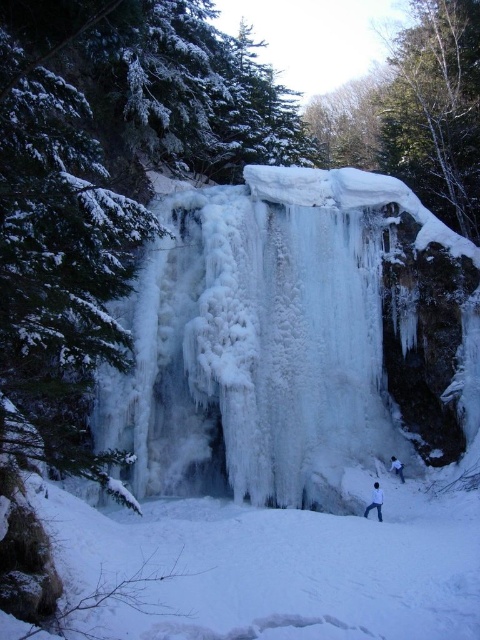
Question: Is white matte jacket at lower center to the right of gray fabric skier at lower right from the viewer's perspective?

Choices:
 (A) yes
 (B) no

Answer: (B)

Question: Is white matte jacket at lower center above gray fabric skier at lower right?

Choices:
 (A) no
 (B) yes

Answer: (A)

Question: Which point appears closest to the camera in this image?

Choices:
 (A) (396, 461)
 (B) (367, 515)

Answer: (B)

Question: From the image, what is the correct spatial relationship of white matte jacket at lower center in relation to gray fabric skier at lower right?

Choices:
 (A) right
 (B) left

Answer: (B)

Question: Which object is farther from the camera taking this photo?

Choices:
 (A) white matte jacket at lower center
 (B) gray fabric skier at lower right

Answer: (B)